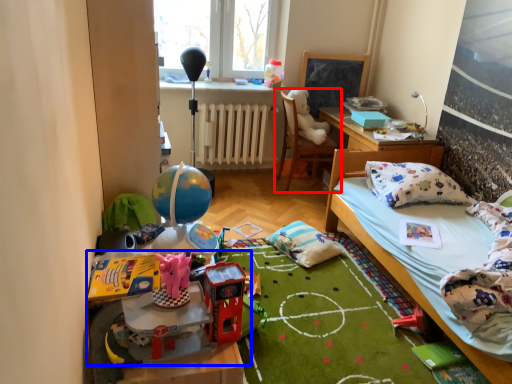
Question: Which point is further to the camera, chair (highlighted by a red box) or toy (highlighted by a blue box)?

Choices:
 (A) chair
 (B) toy

Answer: (A)